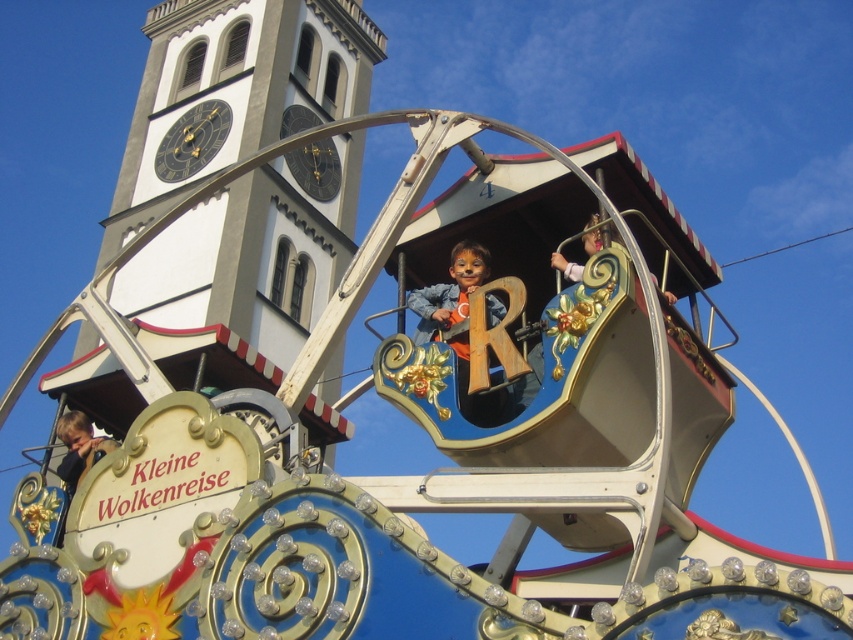
Between white painted stone tower at upper center and matte blue shirt at center, which one appears on the left side from the viewer's perspective?

Positioned to the left is white painted stone tower at upper center.

Does white painted stone tower at upper center appear on the right side of matte blue shirt at center?

Incorrect, white painted stone tower at upper center is not on the right side of matte blue shirt at center.

Does point (171, 90) come in front of point (437, 339)?

No, (171, 90) is behind (437, 339).

Where is `white painted stone tower at upper center`? white painted stone tower at upper center is located at coordinates (233, 90).

How much distance is there between matte blue shirt at center and light brown wooden head at lower left?

They are 11.58 meters apart.

Between matte blue shirt at center and light brown wooden head at lower left, which one has less height?

Standing shorter between the two is matte blue shirt at center.

Describe the element at coordinates (450, 291) in the screenshot. This screenshot has height=640, width=853. I see `matte blue shirt at center` at that location.

This screenshot has height=640, width=853. In order to click on matte blue shirt at center in this screenshot , I will do `click(450, 291)`.

Who is lower down, light brown wooden head at lower left or wooden figure at upper center?

light brown wooden head at lower left is lower down.

Based on the photo, who is more forward, (x=102, y=448) or (x=595, y=243)?

Point (x=595, y=243) is more forward.

Measure the distance between light brown wooden head at lower left and camera.

A distance of 40.36 meters exists between light brown wooden head at lower left and camera.

Where is `light brown wooden head at lower left`? Image resolution: width=853 pixels, height=640 pixels. light brown wooden head at lower left is located at coordinates (78, 445).